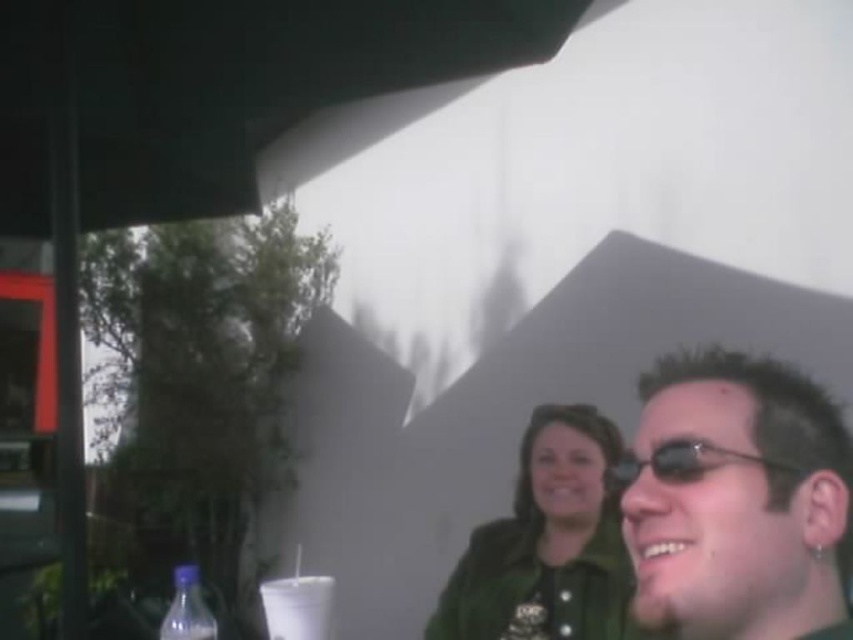
Is green matte jacket at center to the right of white plastic cup at lower center from the viewer's perspective?

Indeed, green matte jacket at center is positioned on the right side of white plastic cup at lower center.

From the picture: Is green matte jacket at center above white plastic cup at lower center?

Incorrect, green matte jacket at center is not positioned above white plastic cup at lower center.

Is point (579, 456) behind point (274, 605)?

Yes, point (579, 456) is farther from viewer.

At what (x,y) coordinates should I click in order to perform the action: click on green matte jacket at center. Please return your answer as a coordinate pair (x, y). The width and height of the screenshot is (853, 640). Looking at the image, I should click on (547, 544).

Can you confirm if shiny black sunglasses at right is wider than white plastic cup at lower center?

Yes, shiny black sunglasses at right is wider than white plastic cup at lower center.

This screenshot has height=640, width=853. Describe the element at coordinates (738, 500) in the screenshot. I see `shiny black sunglasses at right` at that location.

This screenshot has width=853, height=640. Describe the element at coordinates (738, 500) in the screenshot. I see `shiny black sunglasses at right` at that location.

Where is `shiny black sunglasses at right`? The height and width of the screenshot is (640, 853). shiny black sunglasses at right is located at coordinates (738, 500).

Looking at this image, is sunglasses at right to the right of translucent plastic bottle at lower left from the viewer's perspective?

Indeed, sunglasses at right is positioned on the right side of translucent plastic bottle at lower left.

Based on the photo, which is more to the right, sunglasses at right or translucent plastic bottle at lower left?

Positioned to the right is sunglasses at right.

Which is in front, point (656, 464) or point (213, 628)?

Positioned in front is point (656, 464).

Find the location of a particular element. The height and width of the screenshot is (640, 853). sunglasses at right is located at coordinates (685, 461).